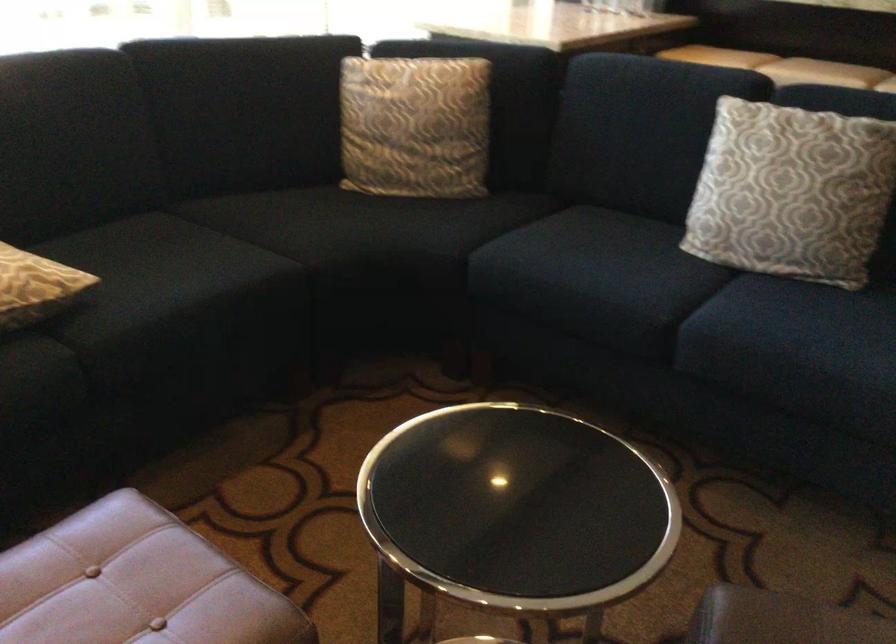
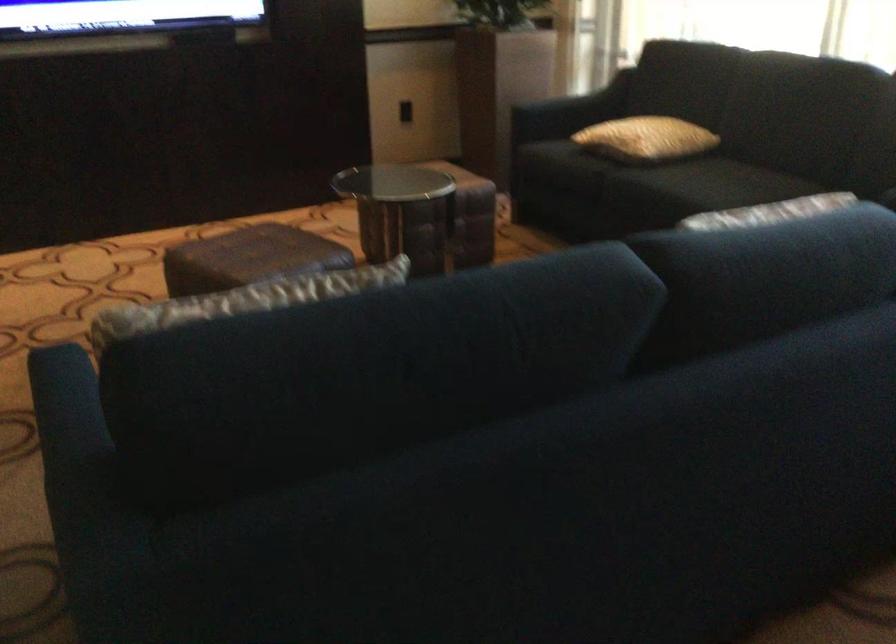
Where in the second image is the point corresponding to (209,260) from the first image?

(709, 184)